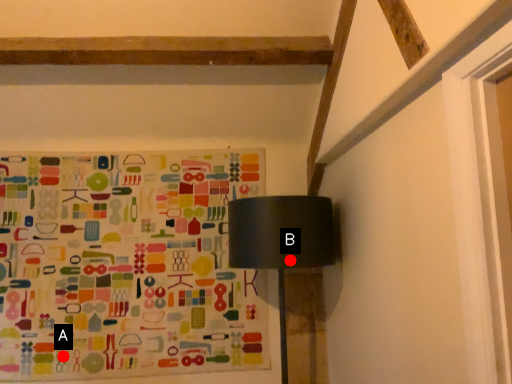
Question: Two points are circled on the image, labeled by A and B beside each circle. Among these points, which one is nearest to the camera?

Choices:
 (A) A is closer
 (B) B is closer

Answer: (B)